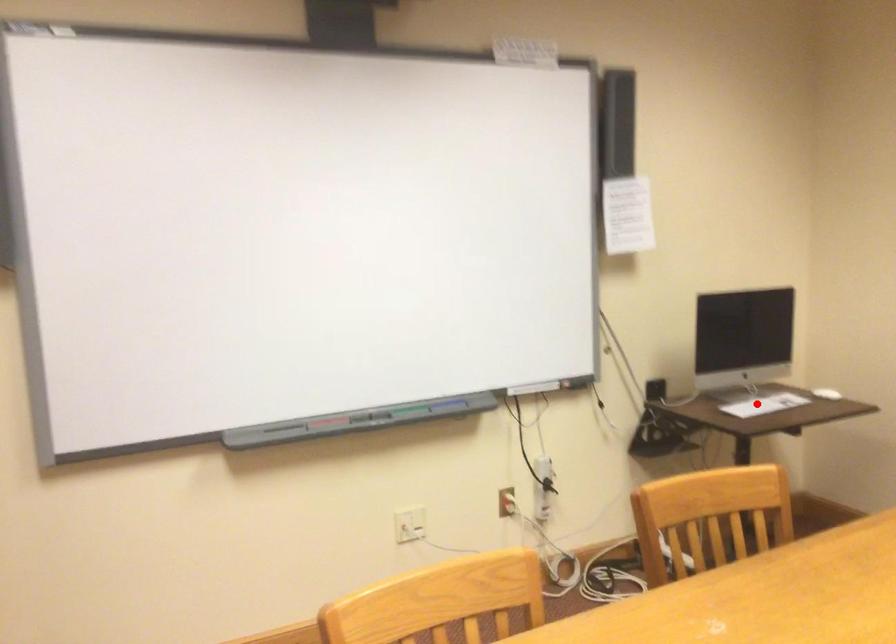
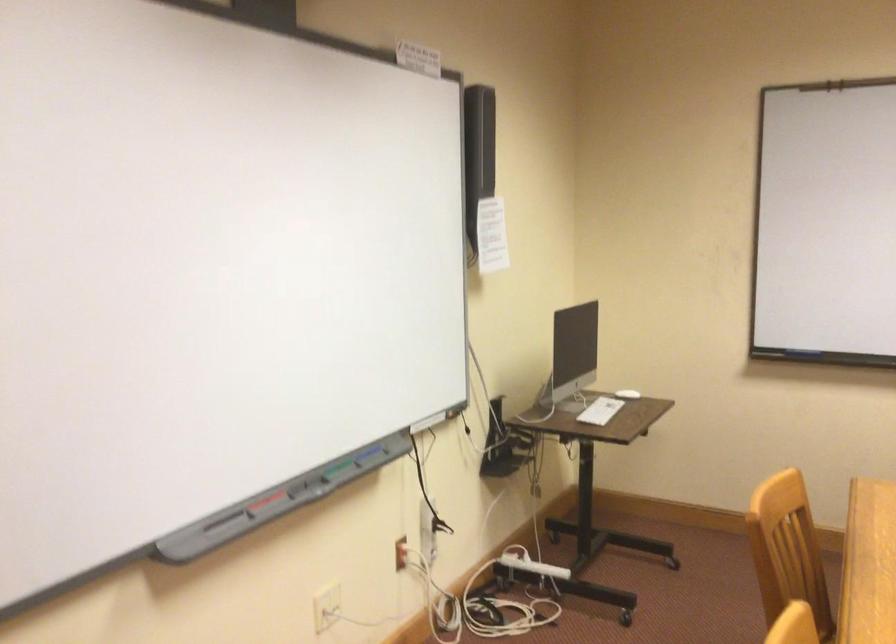
Question: I am providing you with two images of the same scene from different viewpoints. A red point is marked on the first image. Is the red point's position out of view in image 2?

Choices:
 (A) Yes
 (B) No

Answer: (B)